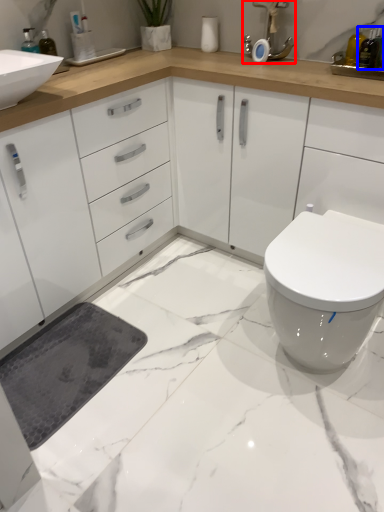
Question: Which point is further to the camera, faucet (highlighted by a red box) or toiletry (highlighted by a blue box)?

Choices:
 (A) faucet
 (B) toiletry

Answer: (A)